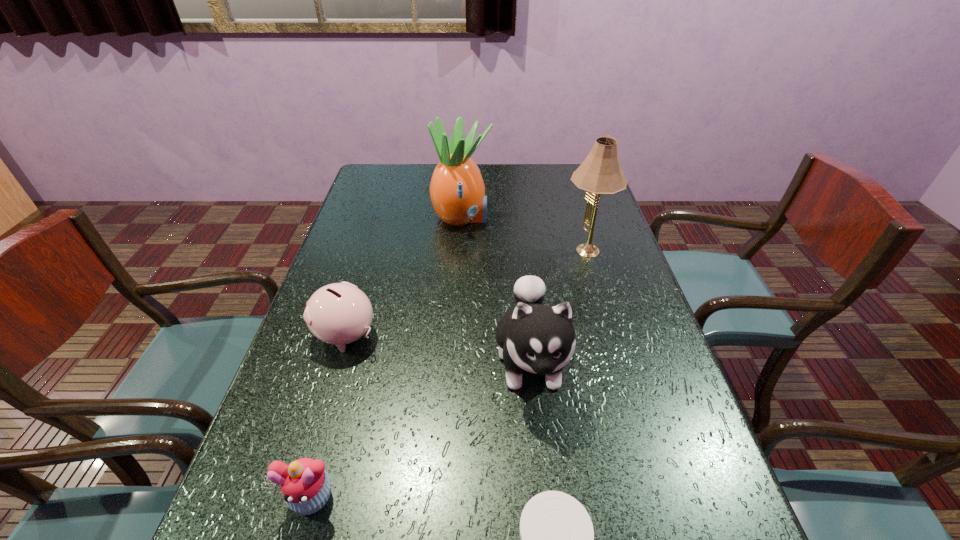
The height and width of the screenshot is (540, 960). Find the location of `the second farthest object`. the second farthest object is located at coordinates (600, 173).

This screenshot has height=540, width=960. Identify the location of lampshade. (600, 173).

Find the location of `the farthest object`. the farthest object is located at coordinates (457, 190).

Where is `the fifth shortest object`? Image resolution: width=960 pixels, height=540 pixels. the fifth shortest object is located at coordinates (457, 190).

At what (x,y) coordinates should I click in order to perform the action: click on the third tallest object. Please return your answer as a coordinate pair (x, y). Image resolution: width=960 pixels, height=540 pixels. Looking at the image, I should click on (540, 339).

Where is `piggy bank`? piggy bank is located at coordinates (339, 313).

At what (x,y) coordinates should I click in order to perform the action: click on cupcake. Please return your answer as a coordinate pair (x, y). Image resolution: width=960 pixels, height=540 pixels. Looking at the image, I should click on (305, 485).

You are a GUI agent. You are given a task and a screenshot of the screen. Output one action in this format:
    pyautogui.click(x=<x>, y=<y>)
    Task: Click on the vacant space situated 0.250m on the back of the rightmost object
    Image resolution: width=960 pixels, height=540 pixels.
    Given the screenshot: What is the action you would take?
    pyautogui.click(x=568, y=196)

At what (x,y) coordinates should I click in order to perform the action: click on vacant space located 0.320m at the entrance of the fifth shortest object. Please return your answer as a coordinate pair (x, y). Image resolution: width=960 pixels, height=540 pixels. Looking at the image, I should click on (591, 218).

Locate an element on the screen. This screenshot has width=960, height=540. free space located at the face of the third tallest object is located at coordinates (543, 471).